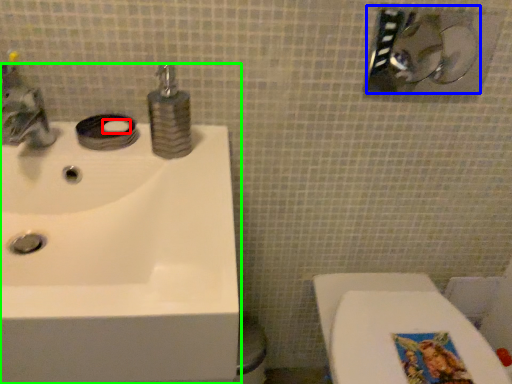
Question: Based on their relative distances, which object is farther from soap (highlighted by a red box)? Choose from shower (highlighted by a blue box) and sink (highlighted by a green box).

Choices:
 (A) shower
 (B) sink

Answer: (A)